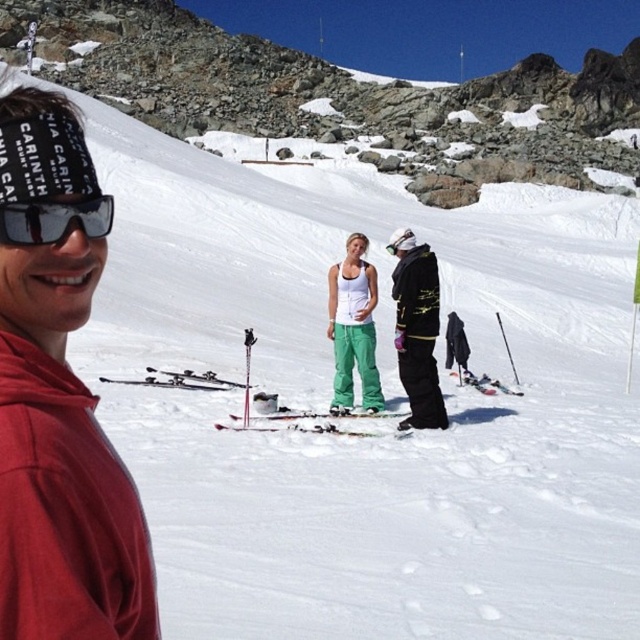
Question: Which of the following is the closest to the observer?

Choices:
 (A) green plastic ski at center
 (B) black matte snowboard at center

Answer: (A)

Question: Where is white matte tank top at center located in relation to black matte sunglasses at left in the image?

Choices:
 (A) above
 (B) below

Answer: (B)

Question: Does white snow at upper center have a lesser width compared to white matte tank top at center?

Choices:
 (A) no
 (B) yes

Answer: (A)

Question: Does black matte sunglasses at left appear on the right side of green plastic ski at center?

Choices:
 (A) yes
 (B) no

Answer: (B)

Question: Which point is farther from the camera taking this photo?

Choices:
 (A) (77, 211)
 (B) (435, 336)
 (C) (99, 4)

Answer: (C)

Question: Which object is the farthest from the red fabric headband at upper left?

Choices:
 (A) green plastic ski at center
 (B) black matte snowboard at center

Answer: (B)